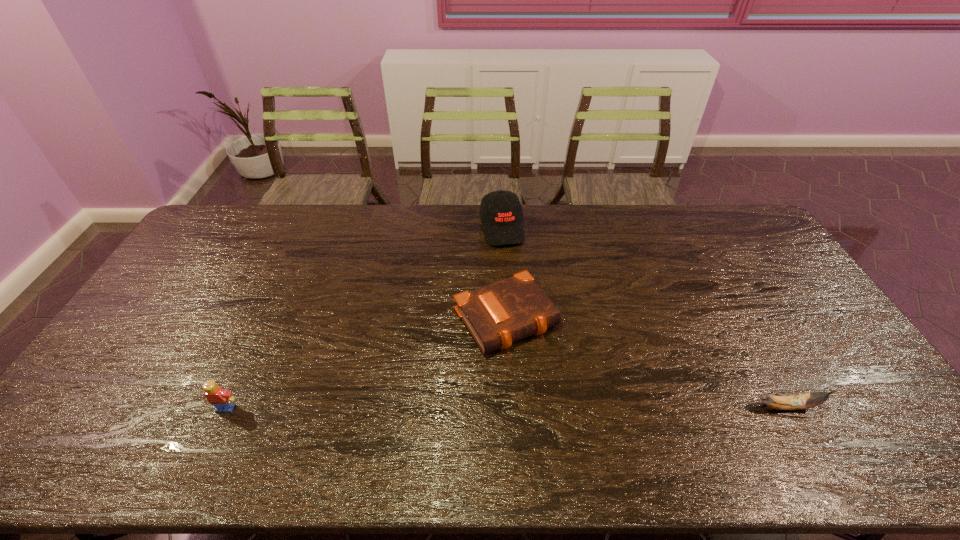
The image size is (960, 540). I want to click on Lego, so (221, 398).

At what (x,y) coordinates should I click in order to perform the action: click on banana. Please return your answer as a coordinate pair (x, y). This screenshot has width=960, height=540. Looking at the image, I should click on (793, 402).

Locate an element on the screen. The width and height of the screenshot is (960, 540). the rightmost object is located at coordinates (793, 402).

Locate an element on the screen. The height and width of the screenshot is (540, 960). the farthest object is located at coordinates [x=501, y=211].

Locate an element on the screen. Image resolution: width=960 pixels, height=540 pixels. the third nearest object is located at coordinates (497, 315).

Where is `Bible`? The width and height of the screenshot is (960, 540). Bible is located at coordinates (497, 315).

Find the location of `vacant space situated 0.060m at the stem of the rightmost object`. vacant space situated 0.060m at the stem of the rightmost object is located at coordinates (843, 407).

At what (x,y) coordinates should I click in order to perform the action: click on free region located 0.120m on the front-facing side of the baseball cap. Please return your answer as a coordinate pair (x, y). Looking at the image, I should click on tap(512, 272).

Locate an element on the screen. The height and width of the screenshot is (540, 960). free region located 0.290m on the front-facing side of the baseball cap is located at coordinates (522, 309).

The image size is (960, 540). Find the location of `free space located 0.380m on the front-facing side of the baseball cap`. free space located 0.380m on the front-facing side of the baseball cap is located at coordinates (528, 332).